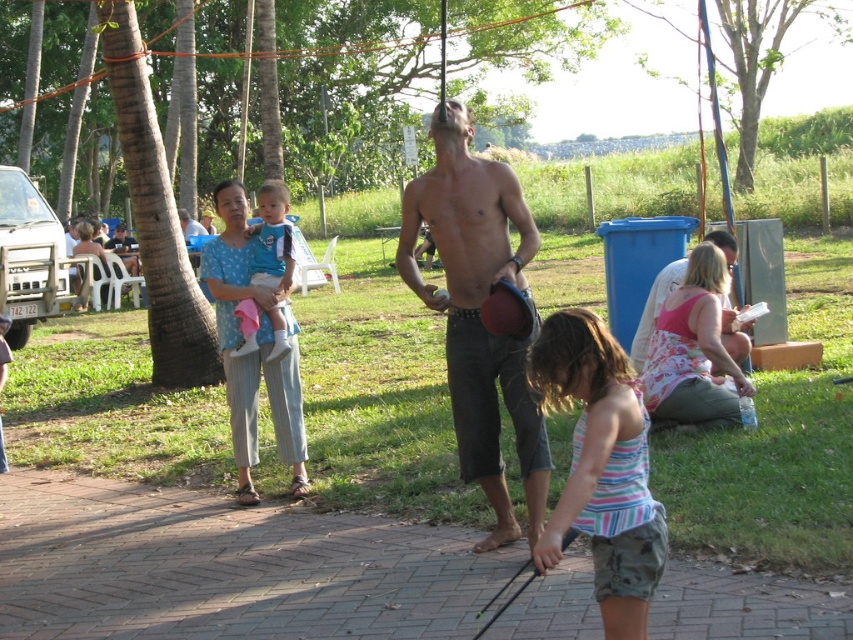
You are a photographer trying to capture a candid shot of both the striped fabric dress at lower center and the blue cotton shirt at center. Since you want to frame them in a single shot, can you confirm if they are positioned side by side horizontally?

The striped fabric dress at lower center is to the right of the blue cotton shirt at center, so they are positioned side by side horizontally and can be captured in a single shot.

You are a photographer trying to capture a photo of the striped fabric dress at lower center and the shiny metallic helmet at center. Which object should you focus on first if you want to include both in your frame without moving the camera?

You should focus on the striped fabric dress at lower center first because it is positioned on the left side of the shiny metallic helmet at center, so capturing it first ensures both objects are within the frame.

You are standing at the point marked as point (512, 417) in the image. If you want to walk back to the starting point where you entered the park, which is exactly 6 meters away from your current position, will you reach the entrance before walking 6 meters?

The distance between point (512, 417) and the viewer is 5.86 meters. Since the entrance is exactly 6 meters away from your current position, you will reach the entrance before walking 6 meters because 5.86 meters is less than 6 meters.